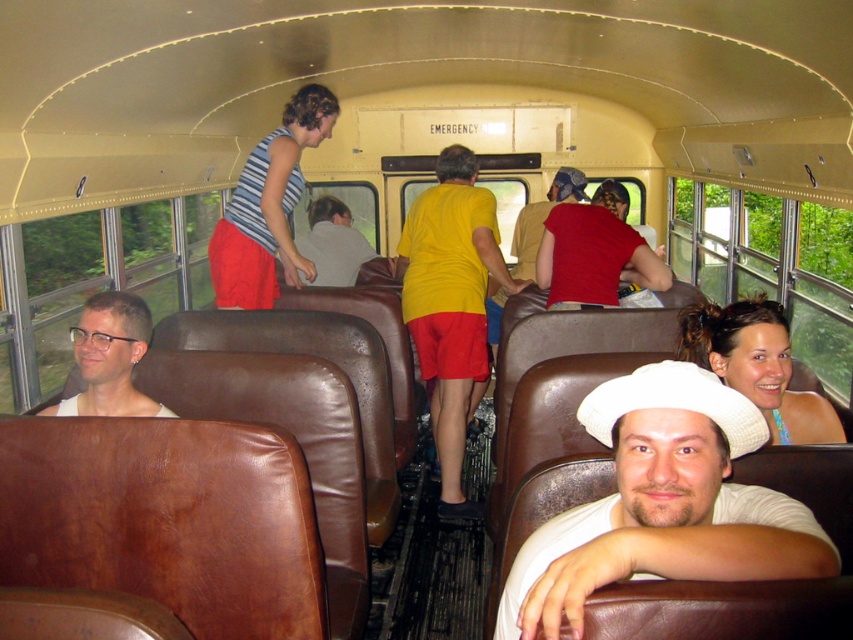
Is yellow matte shirt at center thinner than matte white shirt at left?

In fact, yellow matte shirt at center might be wider than matte white shirt at left.

This screenshot has width=853, height=640. What do you see at coordinates (450, 305) in the screenshot?
I see `yellow matte shirt at center` at bounding box center [450, 305].

Between point (431, 220) and point (100, 362), which one is positioned in front?

Point (100, 362) is in front.

Locate an element on the screen. This screenshot has height=640, width=853. yellow matte shirt at center is located at coordinates (450, 305).

Where is `yellow matte shirt at center`? yellow matte shirt at center is located at coordinates (450, 305).

Does point (514, 284) come behind point (323, 221)?

No, (514, 284) is in front of (323, 221).

The width and height of the screenshot is (853, 640). Identify the location of yellow matte shirt at center. (450, 305).

Is striped tank top at upper center below white cotton hat at lower right?

No.

Is striped tank top at upper center closer to camera compared to white cotton hat at lower right?

No, it is behind white cotton hat at lower right.

This screenshot has height=640, width=853. Find the location of `striped tank top at upper center`. striped tank top at upper center is located at coordinates (268, 208).

Find the location of a particular element. striped tank top at upper center is located at coordinates pyautogui.click(x=268, y=208).